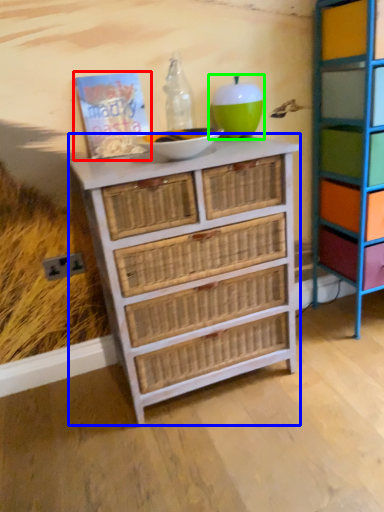
Question: Based on their relative distances, which object is farther from book (highlighted by a red box)? Choose from chest of drawers (highlighted by a blue box) and turquoise (highlighted by a green box).

Choices:
 (A) chest of drawers
 (B) turquoise

Answer: (A)